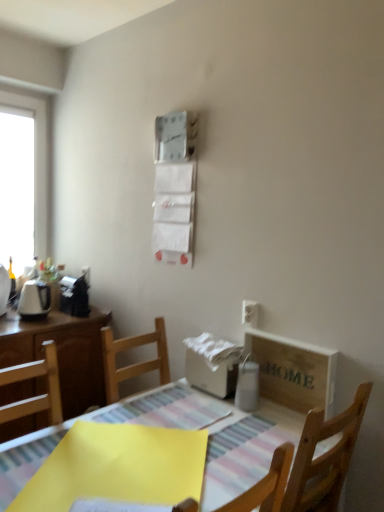
Locate an element on the screen. free space above white glossy window at left (from a real-world perspective) is located at coordinates (20, 88).